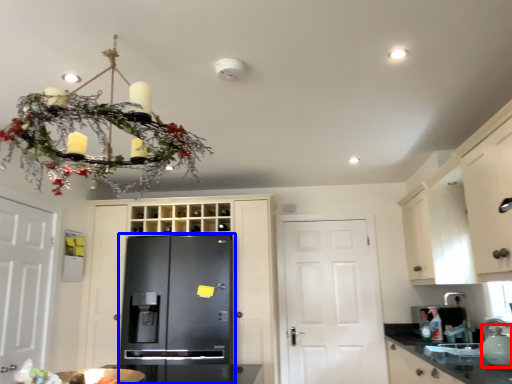
Question: Which object is further to the camera taking this photo, tea pot (highlighted by a red box) or refrigerator (highlighted by a blue box)?

Choices:
 (A) tea pot
 (B) refrigerator

Answer: (B)